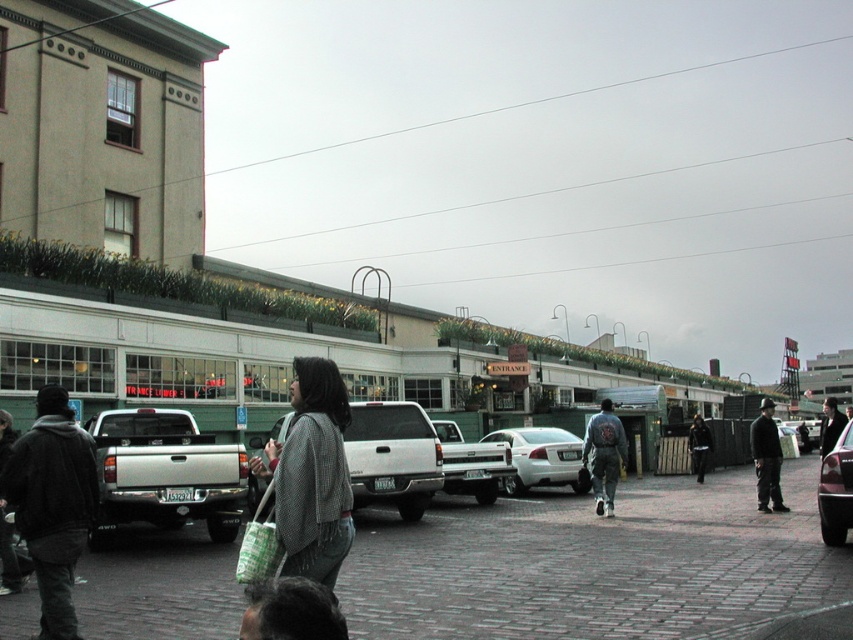
Who is more forward, [229,464] or [286,627]?

Positioned in front is point [286,627].

Can you confirm if silver metallic pickup truck at lower left is thinner than dark gray textured coat at lower center?

In fact, silver metallic pickup truck at lower left might be wider than dark gray textured coat at lower center.

Describe the element at coordinates (165, 474) in the screenshot. I see `silver metallic pickup truck at lower left` at that location.

Locate an element on the screen. silver metallic pickup truck at lower left is located at coordinates tap(165, 474).

Does white matte sedan at center appear under black leather jacket at center?

No.

Does white matte sedan at center lie behind black leather jacket at center?

Yes, it is behind black leather jacket at center.

Is point (572, 454) farther from viewer compared to point (827, 406)?

No, it is in front of (827, 406).

Identify the location of white matte sedan at center. The image size is (853, 640). (541, 458).

Is matte white pickup truck at center positioned before silver metallic truck at center?

That is True.

You are a GUI agent. You are given a task and a screenshot of the screen. Output one action in this format:
    pyautogui.click(x=<x>, y=<y>)
    Task: Click on the matte white pickup truck at center
    
    Given the screenshot: What is the action you would take?
    pyautogui.click(x=392, y=456)